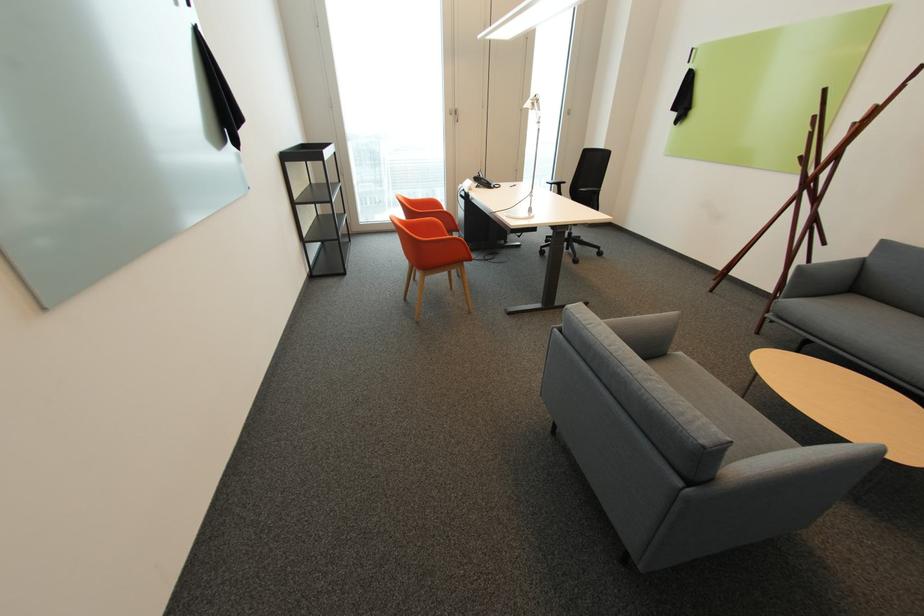
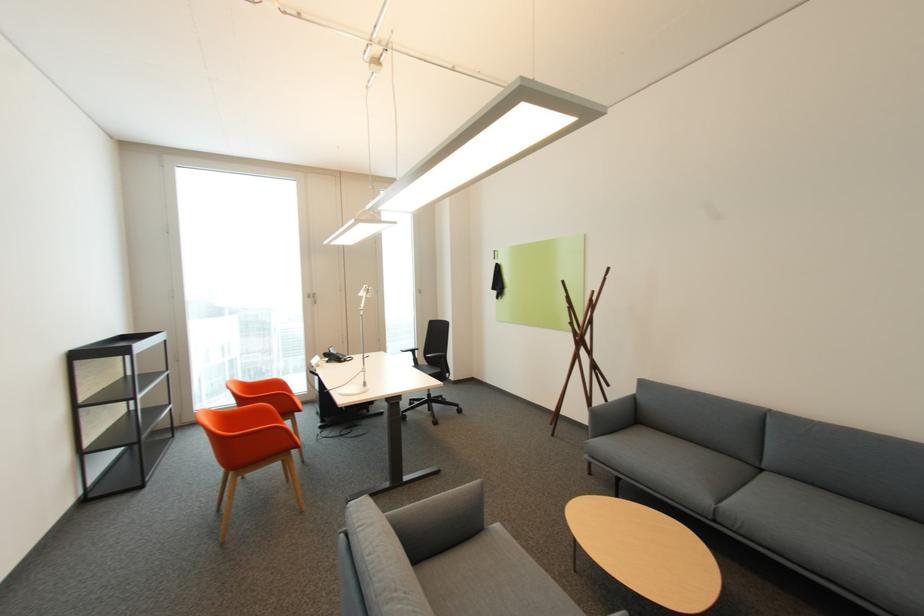
How did the camera likely rotate?

The camera rotated toward right-up.